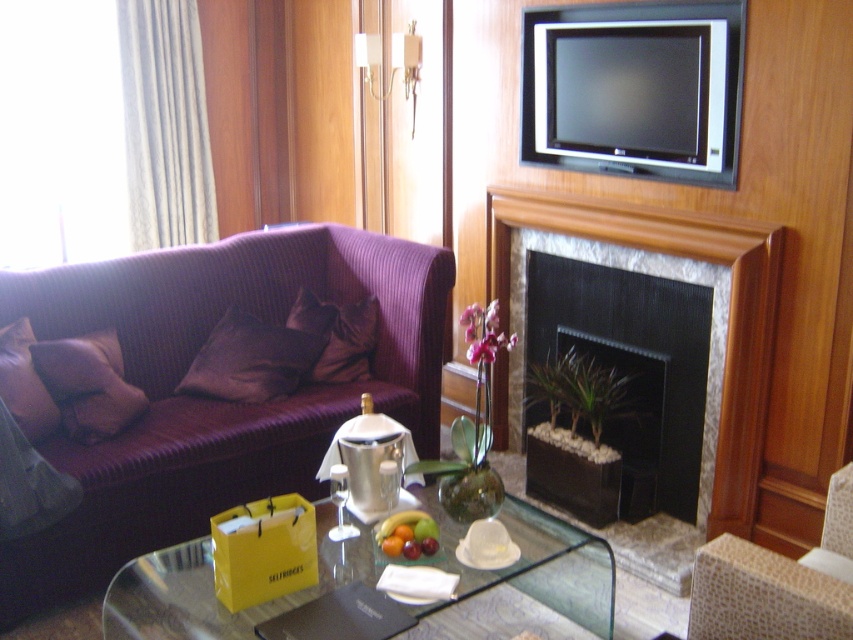
You are standing at the origin point of the room, which is at coordinates 0,0. You want to move to the purple corduroy couch at center. What are the coordinates you need to move to?

The coordinates to move to are (213, 397).